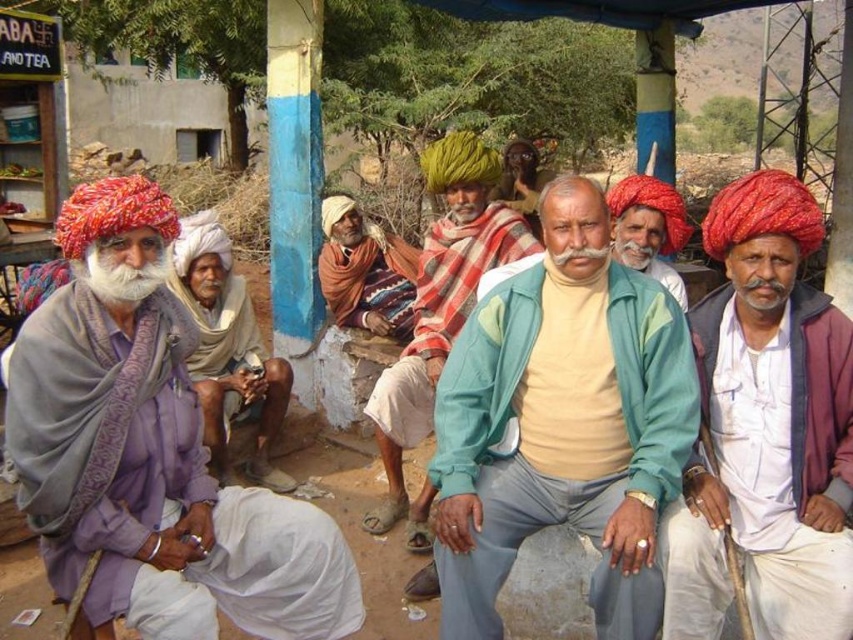
Question: Is white cotton turban at center below striped woolen shawl at center?

Choices:
 (A) yes
 (B) no

Answer: (A)

Question: Which of the following is the farthest from the observer?

Choices:
 (A) matte purple shawl at left
 (B) light blue fabric jacket at center

Answer: (B)

Question: Which point appears closest to the camera in this image?

Choices:
 (A) (421, 397)
 (B) (698, 456)
 (C) (527, 365)
 (D) (122, 294)

Answer: (D)

Question: Among these objects, which one is farthest from the camera?

Choices:
 (A) reddish-brown turban at center
 (B) light blue fabric jacket at center
 (C) matte red turban at right

Answer: (A)

Question: From the image, what is the correct spatial relationship of light blue fabric jacket at center in relation to whitesoftbeard at left?

Choices:
 (A) below
 (B) above

Answer: (A)

Question: Can you confirm if matte red turban at right is positioned below striped woolen shawl at center?

Choices:
 (A) yes
 (B) no

Answer: (A)